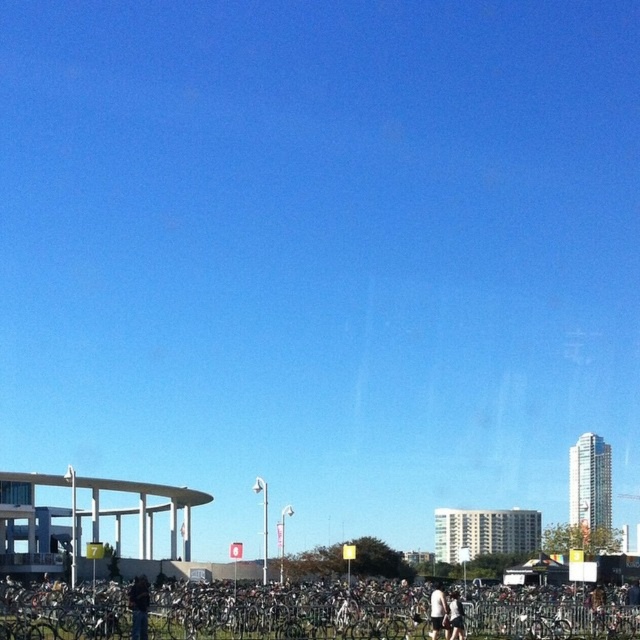
You are a photographer standing in the middle of the bike festival and see the dark brown leather jacket at lower center and the white matte shirt at lower center. Which clothing item is closer to you?

The dark brown leather jacket at lower center is closer to you because it is in front of the white matte shirt at lower center.

You are standing at the entrance of the event and want to find the silver metallic bicycle at center. According to the coordinates provided, where should you look relative to the modern building with a curved roof on the left?

The silver metallic bicycle at center is located at point (285,612), which is closer to the right side of the image. Since the modern building with a curved roof is on the left, you should look towards the right side of the scene to find the silver metallic bicycle at center.